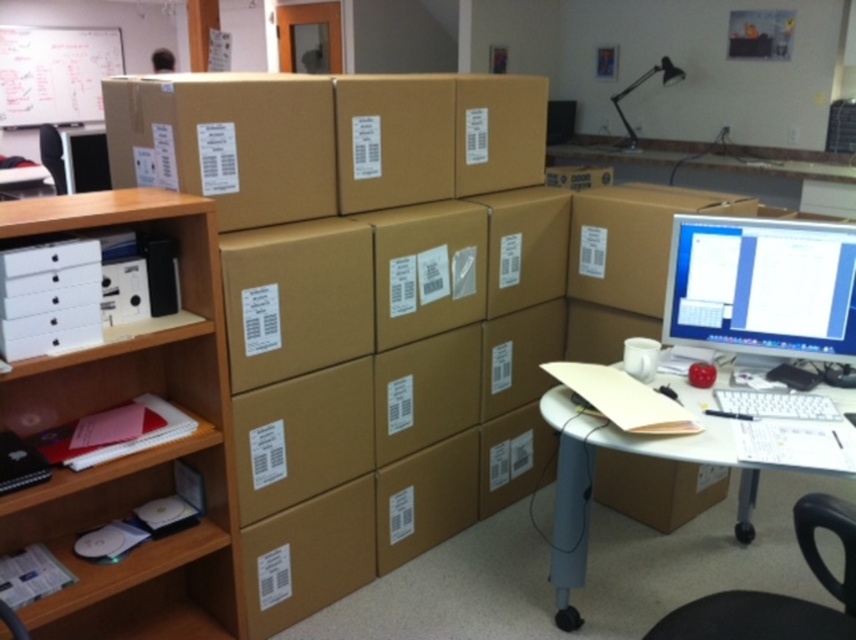
You are organizing the office and need to place a new item on the matte black monitor at right. According to the image, where exactly should you place it?

The matte black monitor at right is located at point (762, 288), so you should place the new item at those coordinates.

From the picture: You are moving into a new office and need to decide where to place your new desk. You have two options in the image provided. The first option is next to the white cardboard bookshelf at left, and the second is next to the black plastic swivel chair at lower right. Considering the size of the objects, which location would provide more space for your desk?

The white cardboard bookshelf at left is bigger than the black plastic swivel chair at lower right, so placing the desk next to the black plastic swivel chair at lower right would leave more space available for the desk.

You are an office worker who needs to move a heavy box from the stack to the white cardboard bookshelf at left and the black plastic swivel chair at lower right. Which location is closer to the stack of boxes?

The white cardboard bookshelf at left is closer to the stack of boxes because it is located to the left of the black plastic swivel chair at lower right, which is farther away.